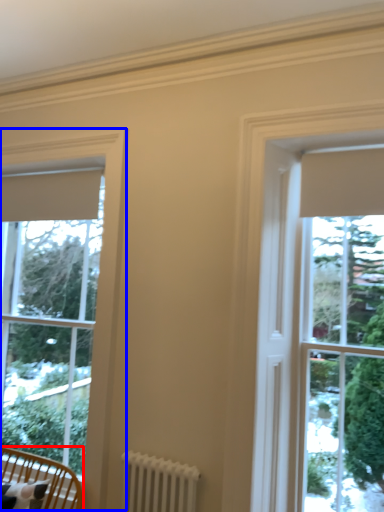
Question: Which point is closer to the camera, furniture (highlighted by a red box) or window (highlighted by a blue box)?

Choices:
 (A) furniture
 (B) window

Answer: (A)